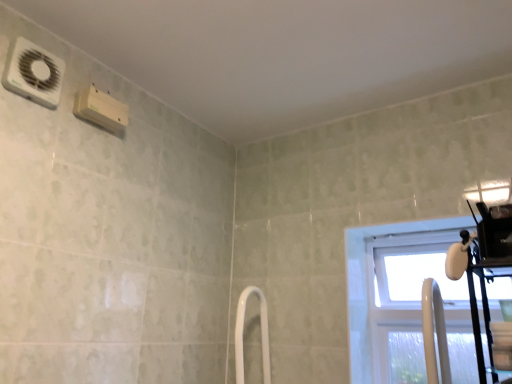
Question: Is transparent plastic window at right not inside white glossy shower door at center?

Choices:
 (A) yes
 (B) no

Answer: (A)

Question: Is transparent plastic window at right thinner than white glossy shower door at center?

Choices:
 (A) yes
 (B) no

Answer: (A)

Question: Is the position of transparent plastic window at right more distant than that of white glossy shower door at center?

Choices:
 (A) no
 (B) yes

Answer: (A)

Question: Can you confirm if transparent plastic window at right is positioned to the right of white glossy shower door at center?

Choices:
 (A) no
 (B) yes

Answer: (B)

Question: Is there a large distance between transparent plastic window at right and white glossy shower door at center?

Choices:
 (A) no
 (B) yes

Answer: (A)

Question: From a real-world perspective, does transparent plastic window at right sit lower than white glossy shower door at center?

Choices:
 (A) no
 (B) yes

Answer: (A)

Question: From the image's perspective, does white glossy shower door at center appear lower than white plastic air conditioning unit at upper left?

Choices:
 (A) no
 (B) yes

Answer: (B)

Question: Is white glossy shower door at center to the right of white plastic air conditioning unit at upper left from the viewer's perspective?

Choices:
 (A) no
 (B) yes

Answer: (B)

Question: Could you tell me if white glossy shower door at center is facing white plastic air conditioning unit at upper left?

Choices:
 (A) no
 (B) yes

Answer: (A)

Question: Can you confirm if white glossy shower door at center is smaller than white plastic air conditioning unit at upper left?

Choices:
 (A) yes
 (B) no

Answer: (B)

Question: Can you confirm if white glossy shower door at center is wider than white plastic air conditioning unit at upper left?

Choices:
 (A) no
 (B) yes

Answer: (B)

Question: Considering the relative sizes of white glossy shower door at center and white plastic air conditioning unit at upper left in the image provided, is white glossy shower door at center shorter than white plastic air conditioning unit at upper left?

Choices:
 (A) no
 (B) yes

Answer: (A)

Question: Is white glossy shower door at center with transparent plastic window at right?

Choices:
 (A) no
 (B) yes

Answer: (A)